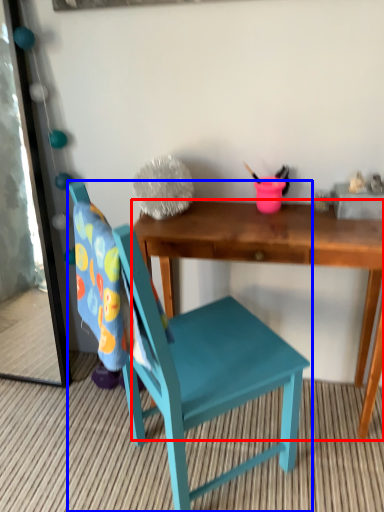
Question: Which object is further to the camera taking this photo, desk (highlighted by a red box) or chair (highlighted by a blue box)?

Choices:
 (A) desk
 (B) chair

Answer: (A)